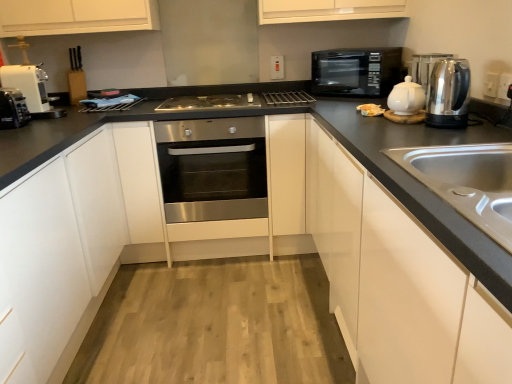
The width and height of the screenshot is (512, 384). Identify the location of free region under white plastic toaster at left (from a real-world perspective). (12, 129).